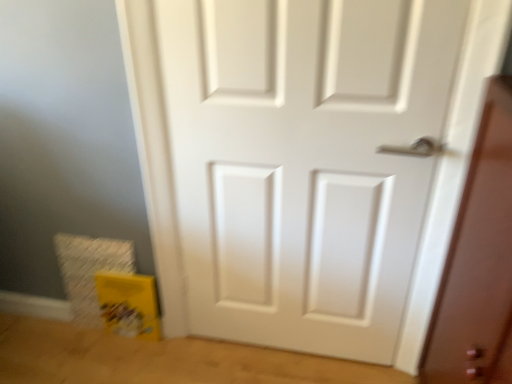
Image resolution: width=512 pixels, height=384 pixels. What do you see at coordinates (303, 163) in the screenshot?
I see `white matte door at center` at bounding box center [303, 163].

What are the coordinates of `white matte door at center` in the screenshot? It's located at (303, 163).

I want to click on matte white door at right, so click(x=478, y=262).

What do you see at coordinates (478, 262) in the screenshot? The width and height of the screenshot is (512, 384). I see `matte white door at right` at bounding box center [478, 262].

Locate an element on the screen. The height and width of the screenshot is (384, 512). white matte door at center is located at coordinates (303, 163).

Does white matte door at center appear on the right side of matte white door at right?

No, white matte door at center is not to the right of matte white door at right.

Considering the positions of objects white matte door at center and matte white door at right in the image provided, who is in front, white matte door at center or matte white door at right?

Positioned in front is matte white door at right.

Between point (366, 81) and point (444, 330), which one is positioned in front?

The point (366, 81) is in front.

From the image's perspective, which object appears higher, white matte door at center or matte white door at right?

From the image's view, white matte door at center is above.

From a real-world perspective, who is located higher, white matte door at center or matte white door at right?

white matte door at center.

Considering the relative sizes of white matte door at center and matte white door at right in the image provided, is white matte door at center wider than matte white door at right?

Incorrect, the width of white matte door at center does not surpass that of matte white door at right.

Can you confirm if white matte door at center is shorter than matte white door at right?

No, white matte door at center is not shorter than matte white door at right.

Looking at this image, based on their sizes in the image, would you say white matte door at center is bigger or smaller than matte white door at right?

white matte door at center is smaller than matte white door at right.

Would you say white matte door at center is outside matte white door at right?

Absolutely, white matte door at center is external to matte white door at right.

Is white matte door at center directly adjacent to matte white door at right?

No, white matte door at center is not next to matte white door at right.

Is white matte door at center looking in the opposite direction of matte white door at right?

That's not correct — white matte door at center is not looking away from matte white door at right.

What's the angular difference between white matte door at center and matte white door at right's facing directions?

89.6 degrees.

You are a GUI agent. You are given a task and a screenshot of the screen. Output one action in this format:
    pyautogui.click(x=<x>, y=<y>)
    Task: Click on the door above the matte white door at right (from a real-world perspective)
    Image resolution: width=512 pixels, height=384 pixels.
    Given the screenshot: What is the action you would take?
    pyautogui.click(x=303, y=163)

Based on the photo, can you confirm if matte white door at right is positioned to the right of white matte door at center?

Indeed, matte white door at right is positioned on the right side of white matte door at center.

Who is more distant, matte white door at right or white matte door at center?

white matte door at center.

Does point (441, 358) come behind point (418, 116)?

Yes, it is behind point (418, 116).

Looking at this image, from the image's perspective, relative to white matte door at center, is matte white door at right above or below?

matte white door at right is situated lower than white matte door at center in the image.

From a real-world perspective, is matte white door at right under white matte door at center?

Yes.

Can you confirm if matte white door at right is wider than white matte door at center?

Yes, matte white door at right is wider than white matte door at center.

Does matte white door at right have a lesser height compared to white matte door at center?

Yes, matte white door at right is shorter than white matte door at center.

Looking at this image, which of these two, matte white door at right or white matte door at center, is bigger?

With larger size is matte white door at right.

Which is correct: matte white door at right is inside white matte door at center, or outside of it?

matte white door at right is outside white matte door at center.

Are matte white door at right and white matte door at center beside each other?

No.

Could you tell me if matte white door at right is turned towards white matte door at center?

Yes, matte white door at right is aimed at white matte door at center.

At what (x,y) coordinates should I click in order to perform the action: click on screen door on the right of white matte door at center. Please return your answer as a coordinate pair (x, y). The image size is (512, 384). Looking at the image, I should click on (478, 262).

At what (x,y) coordinates should I click in order to perform the action: click on door above the matte white door at right (from a real-world perspective). Please return your answer as a coordinate pair (x, y). This screenshot has height=384, width=512. Looking at the image, I should click on (303, 163).

In the image, there is a matte white door at right. Identify the location of door above it (from the image's perspective). The image size is (512, 384). (303, 163).